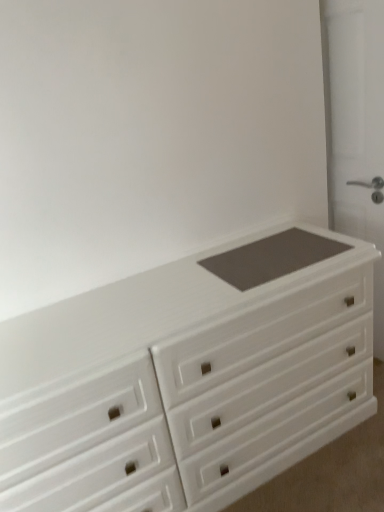
Question: Would you say matte gray screen door at right is outside white glossy chest of drawers at center?

Choices:
 (A) yes
 (B) no

Answer: (A)

Question: Is matte gray screen door at right aimed at white glossy chest of drawers at center?

Choices:
 (A) no
 (B) yes

Answer: (A)

Question: Is the position of matte gray screen door at right less distant than that of white glossy chest of drawers at center?

Choices:
 (A) no
 (B) yes

Answer: (A)

Question: Is matte gray screen door at right wider than white glossy chest of drawers at center?

Choices:
 (A) yes
 (B) no

Answer: (B)

Question: Is the surface of matte gray screen door at right in direct contact with white glossy chest of drawers at center?

Choices:
 (A) yes
 (B) no

Answer: (B)

Question: From the image's perspective, would you say matte gray screen door at right is positioned over white glossy chest of drawers at center?

Choices:
 (A) yes
 (B) no

Answer: (A)

Question: Does white glossy chest of drawers at center have a greater height compared to matte gray screen door at right?

Choices:
 (A) yes
 (B) no

Answer: (B)

Question: Is white glossy chest of drawers at center not inside matte gray screen door at right?

Choices:
 (A) yes
 (B) no

Answer: (A)

Question: From a real-world perspective, is white glossy chest of drawers at center beneath matte gray screen door at right?

Choices:
 (A) no
 (B) yes

Answer: (B)

Question: Is white glossy chest of drawers at center beside matte gray screen door at right?

Choices:
 (A) yes
 (B) no

Answer: (B)

Question: Is white glossy chest of drawers at center wider than matte gray screen door at right?

Choices:
 (A) no
 (B) yes

Answer: (B)

Question: Can you confirm if white glossy chest of drawers at center is positioned to the right of matte gray screen door at right?

Choices:
 (A) yes
 (B) no

Answer: (B)

Question: Looking at their shapes, would you say white glossy chest of drawers at center is wider or thinner than matte gray screen door at right?

Choices:
 (A) thin
 (B) wide

Answer: (B)